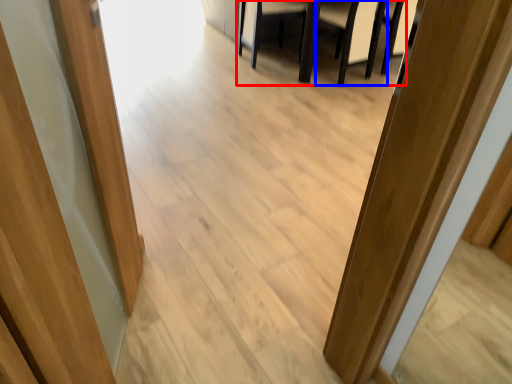
Question: Which of the following is the farthest to the observer, furniture (highlighted by a red box) or armchair (highlighted by a blue box)?

Choices:
 (A) furniture
 (B) armchair

Answer: (A)